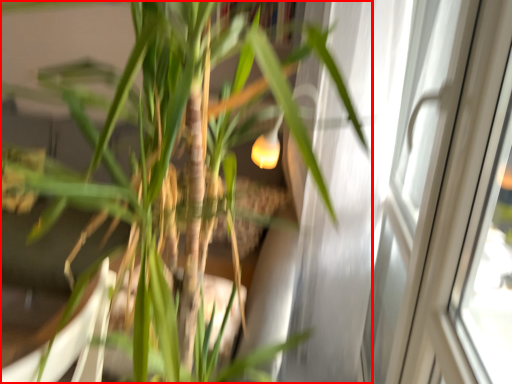
Question: Where is houseplant (annotated by the red box) located in relation to screen door in the image?

Choices:
 (A) left
 (B) right

Answer: (A)